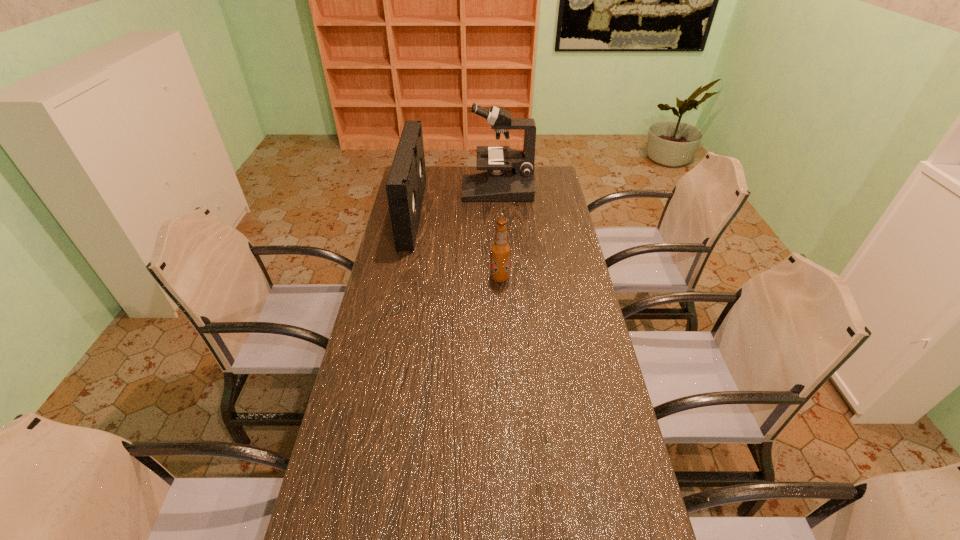
Locate an element on the screen. Image resolution: width=960 pixels, height=540 pixels. free space between the tallest object and the second tallest object is located at coordinates (455, 201).

I want to click on vacant space in between the videotape and the beer bottle, so click(456, 245).

Identify the location of object that is the second nearest to the leftmost object. The height and width of the screenshot is (540, 960). (500, 250).

Identify which object is the closest to the microscope. Please provide its 2D coordinates. Your answer should be formatted as a tuple, i.e. [(x, y)], where the tuple contains the x and y coordinates of a point satisfying the conditions above.

[(406, 183)]